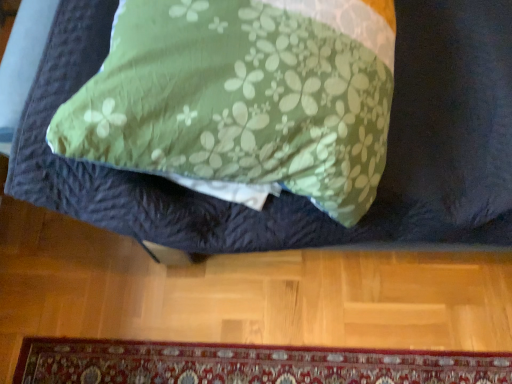
Locate an element on the screen. The image size is (512, 384). empty space that is ontop of carpeted mat at lower center (from a real-world perspective) is located at coordinates (249, 363).